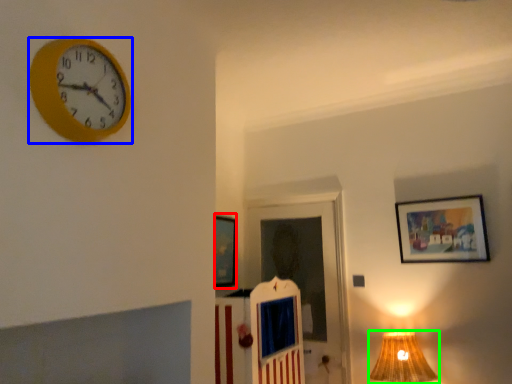
Question: Which is nearer to the picture frame (highlighted by a red box)? wall clock (highlighted by a blue box) or table lamp (highlighted by a green box).

Choices:
 (A) wall clock
 (B) table lamp

Answer: (B)